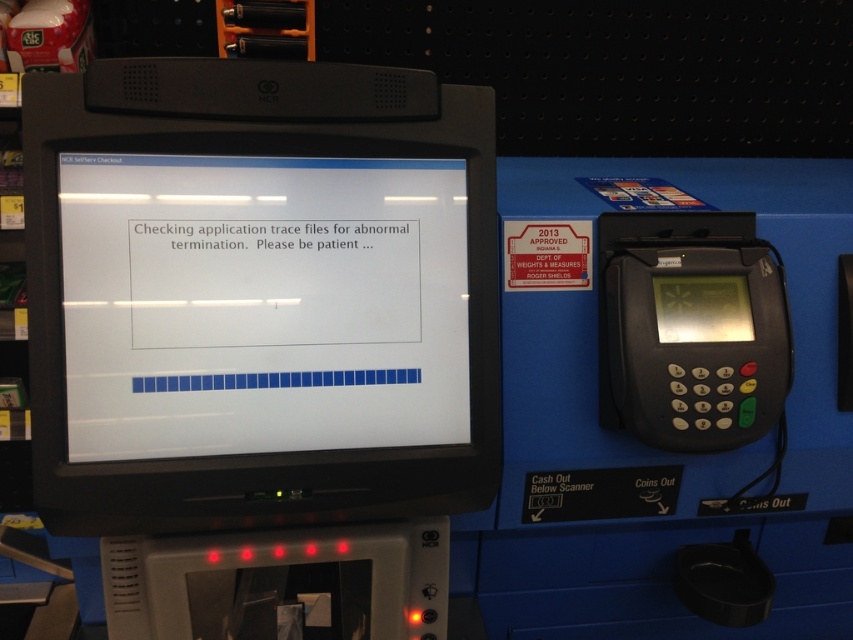
Question: From the image, what is the correct spatial relationship of black glossy monitor at center in relation to black plastic keypad at right?

Choices:
 (A) below
 (B) above

Answer: (B)

Question: Is black glossy monitor at center positioned at the back of black plastic keypad at right?

Choices:
 (A) no
 (B) yes

Answer: (A)

Question: Among these objects, which one is nearest to the camera?

Choices:
 (A) black glossy monitor at center
 (B) black plastic keypad at right

Answer: (A)

Question: Does black glossy monitor at center have a greater width compared to black plastic keypad at right?

Choices:
 (A) yes
 (B) no

Answer: (A)